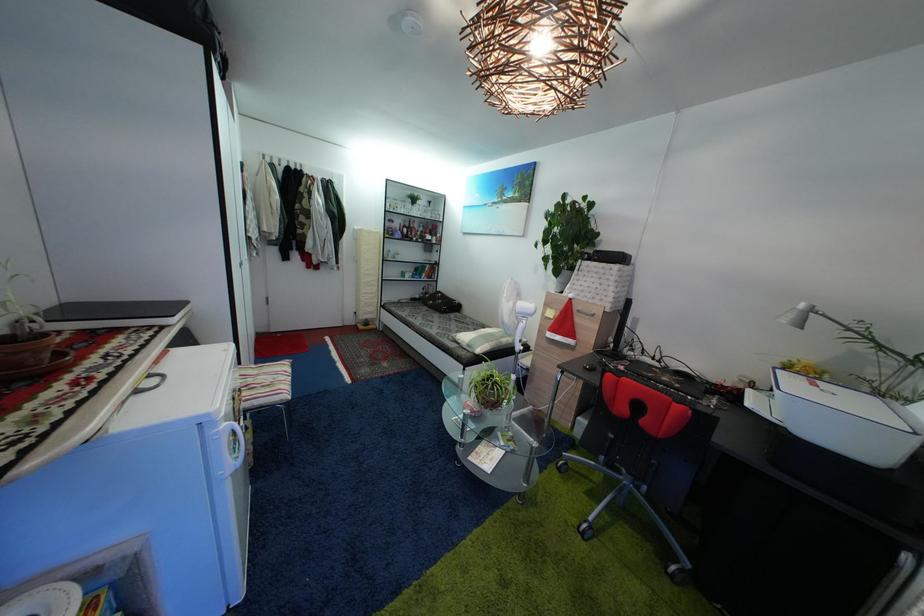
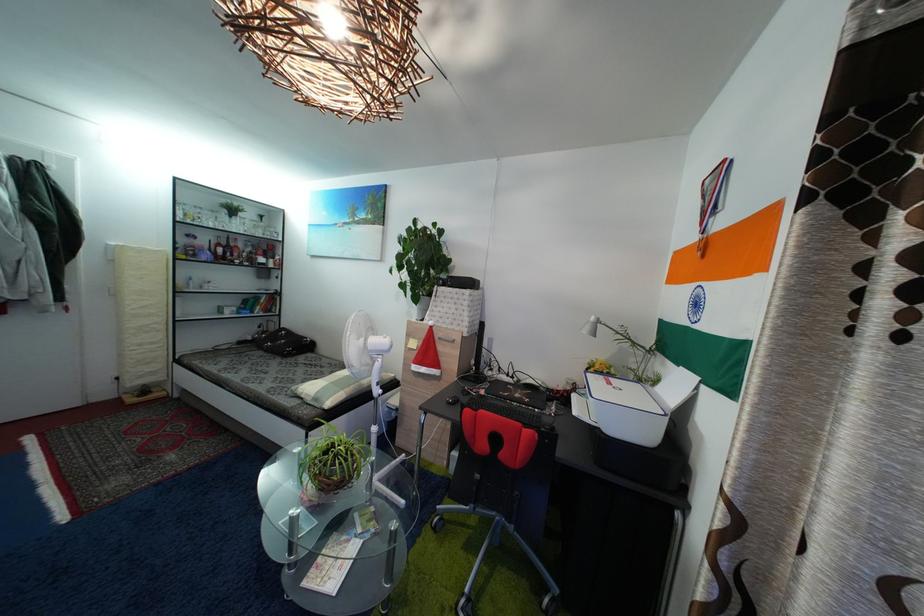
Where in the second image is the point corresponding to the point at 416,233 from the first image?

(233, 251)